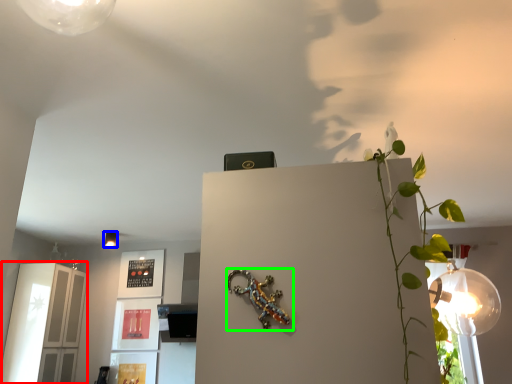
Question: Considering the real-world distances, which object is closest to glass door (highlighted by a red box)? lamp (highlighted by a blue box) or lizard (highlighted by a green box).

Choices:
 (A) lamp
 (B) lizard

Answer: (A)